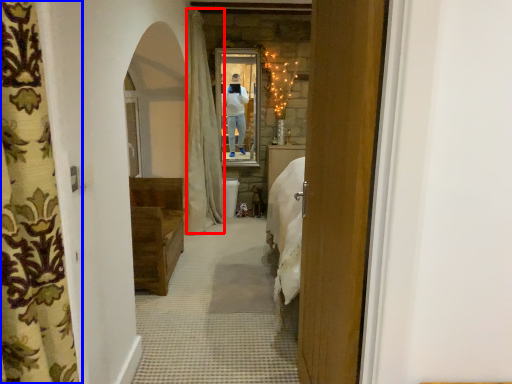
Question: Which point is further to the camera, curtain (highlighted by a red box) or curtain (highlighted by a blue box)?

Choices:
 (A) curtain
 (B) curtain

Answer: (A)